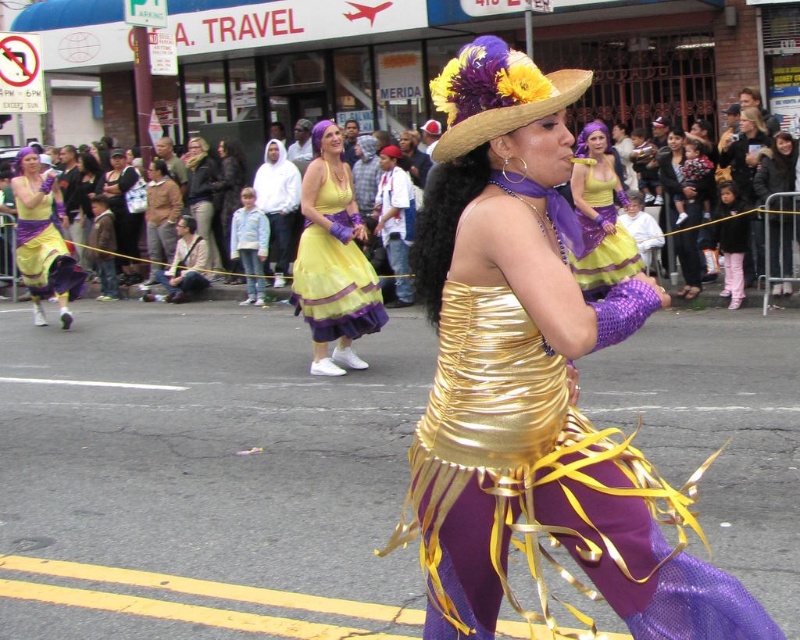
You are a photographer trying to capture the parade participants. You notice two specific items in the scene. One is the pink fabric pants at right, and the other is the matte black jacket at upper center. Based on their positions, which one is located to the right side of the other?

The pink fabric pants at right are to the right of the matte black jacket at upper center.

You are a photographer capturing the parade scene. You want to focus on the woman in the gold, ruched top and purple pants with yellow ribbons. There are two points in the image marked as point 1 at coordinates point (742,260) and point 2 at coordinates point (186,154). Which point should you adjust your focus to ensure the woman is in sharp focus?

Point 1 at coordinates point (742,260) is closer to the camera than point 2 at coordinates point (186,154). Therefore, to ensure the woman in the gold, ruched top and purple pants with yellow ribbons is in sharp focus, you should adjust your focus to point 1 at coordinates point (742,260).

You are a photographer at the parade. You want to take a photo of the pink fabric pants at right. Where should you aim your camera to capture them?

To capture the pink fabric pants at right, aim your camera at point 0.380 on the x axis and 0.915 on the y axis.